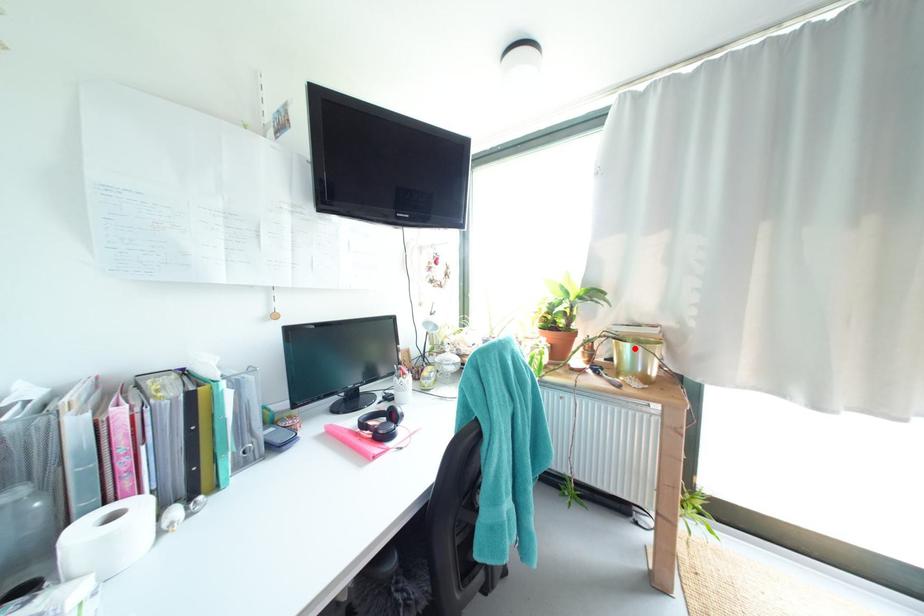
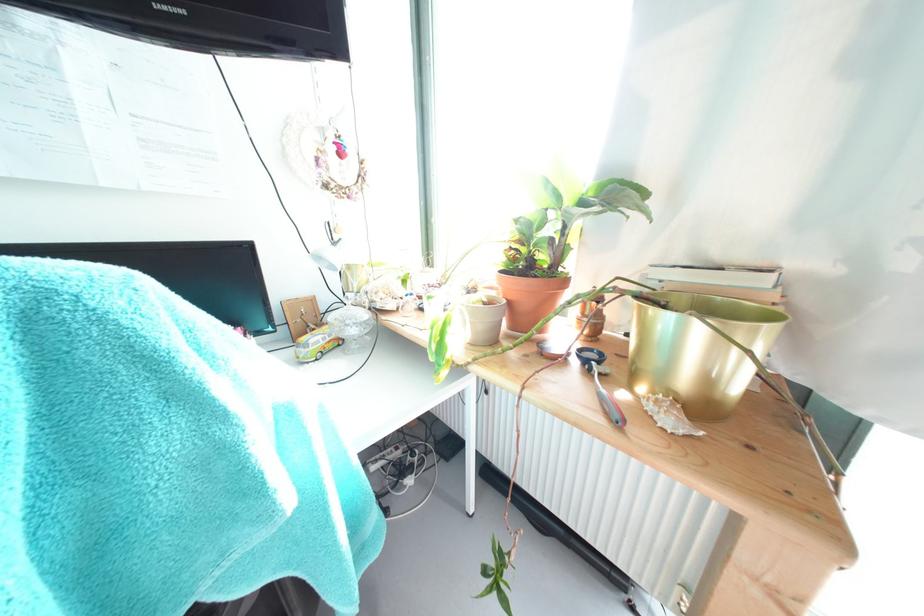
Where in the second image is the point corresponding to the highlighted location from the first image?

(675, 321)